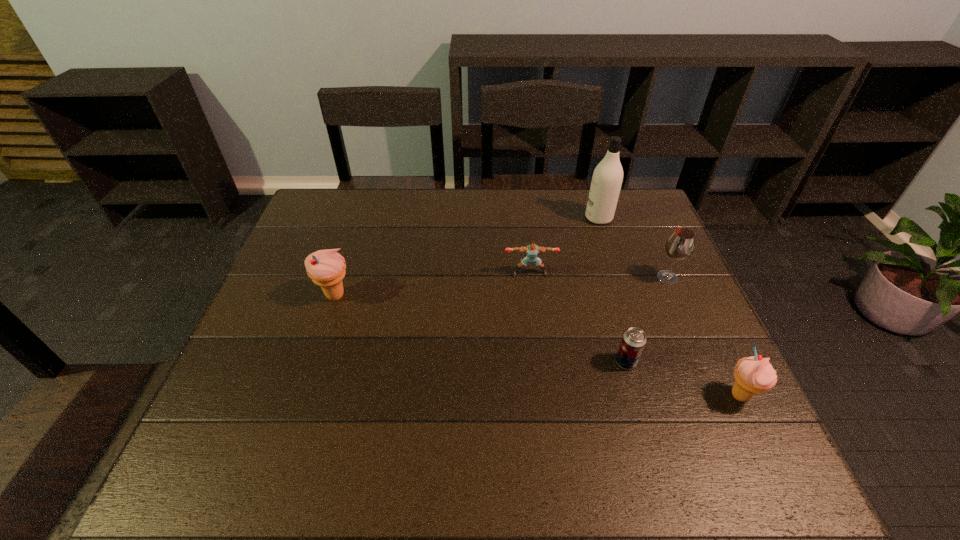
The width and height of the screenshot is (960, 540). Find the location of `icecream at the right edge`. icecream at the right edge is located at coordinates (754, 374).

This screenshot has height=540, width=960. I want to click on wineglass located in the right edge section of the desktop, so click(x=680, y=245).

The image size is (960, 540). I want to click on shampoo that is at the right edge, so click(x=607, y=178).

In order to click on object positioned at the far right corner in this screenshot , I will do `click(607, 178)`.

Locate an element on the screen. The image size is (960, 540). object at the near right corner is located at coordinates (754, 374).

The width and height of the screenshot is (960, 540). I want to click on vacant region at the far edge of the desktop, so click(x=498, y=219).

Image resolution: width=960 pixels, height=540 pixels. What are the coordinates of `vacant space at the near edge` in the screenshot? It's located at (646, 406).

Where is `vacant space at the left edge of the desktop`? vacant space at the left edge of the desktop is located at coordinates (x=258, y=331).

I want to click on free space at the right edge of the desktop, so click(659, 353).

Find the location of a particular element. The image size is (960, 540). blank space at the far left corner of the desktop is located at coordinates (330, 217).